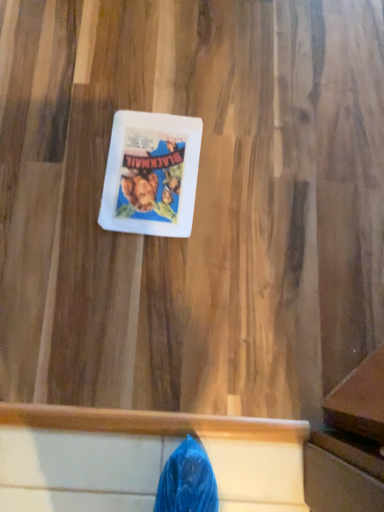
Locate an element on the screen. free space to the right of white matte comic book at center is located at coordinates (246, 185).